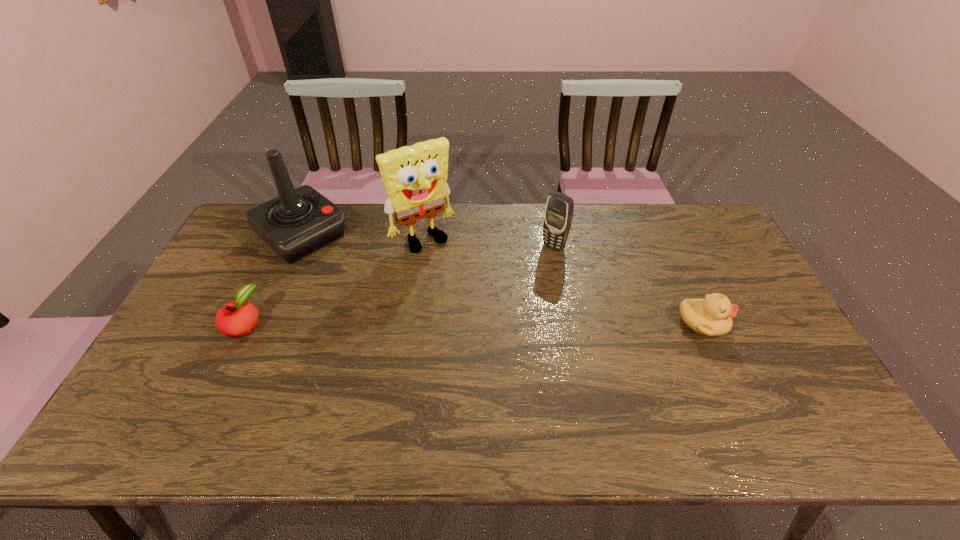
I want to click on vacant space located on the face of the third object from left to right, so click(x=485, y=313).

The width and height of the screenshot is (960, 540). Find the location of `free spot located on the face of the third object from left to right`. free spot located on the face of the third object from left to right is located at coordinates (500, 332).

In order to click on vacant space located on the front face of the cellular telephone in this screenshot , I will do 472,322.

This screenshot has width=960, height=540. I want to click on vacant space located on the front face of the cellular telephone, so click(x=500, y=295).

The width and height of the screenshot is (960, 540). I want to click on vacant point located on the front face of the cellular telephone, so click(x=474, y=320).

Image resolution: width=960 pixels, height=540 pixels. In order to click on free space located on the front-facing side of the joystick in this screenshot , I will do `click(360, 285)`.

Identify the location of blank space located 0.270m on the front-facing side of the joystick. This screenshot has height=540, width=960. (378, 300).

Image resolution: width=960 pixels, height=540 pixels. I want to click on free spot located on the front-facing side of the joystick, so click(x=401, y=320).

This screenshot has width=960, height=540. What are the coordinates of `sponge that is at the far edge` in the screenshot? It's located at (415, 177).

Identify the location of cellular telephone at the far edge. The image size is (960, 540). (558, 215).